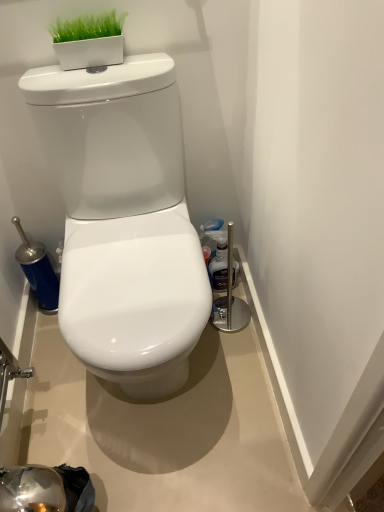
The image size is (384, 512). In order to click on vacant region in front of white glossy toilet at center in this screenshot , I will do `click(180, 460)`.